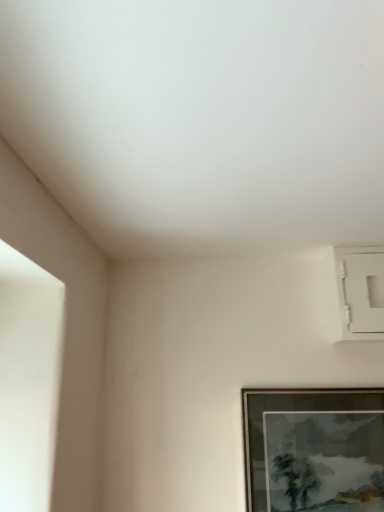
At what (x,y) coordinates should I click in order to perform the action: click on wooden framed painting at lower right. Please return your answer as a coordinate pair (x, y). Image resolution: width=384 pixels, height=512 pixels. Looking at the image, I should click on (314, 450).

Describe the element at coordinates (314, 450) in the screenshot. This screenshot has height=512, width=384. I see `wooden framed painting at lower right` at that location.

Measure the distance between point (x=355, y=419) and camera.

A distance of 4.20 feet exists between point (x=355, y=419) and camera.

The image size is (384, 512). In order to click on wooden framed painting at lower right in this screenshot , I will do `click(314, 450)`.